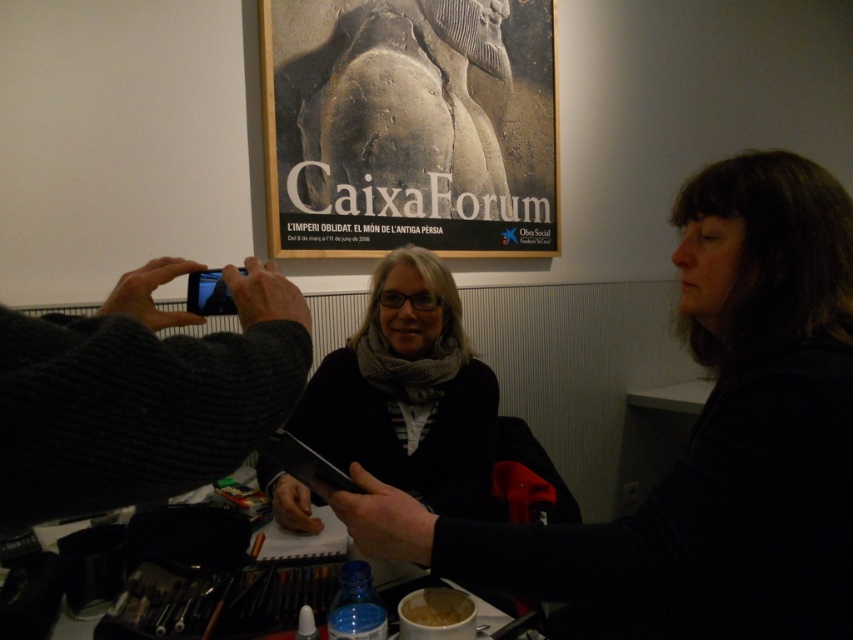
Question: Which of the following is the farthest from the observer?

Choices:
 (A) knitted dark gray sweater at left
 (B) wooden table at center

Answer: (B)

Question: Estimate the real-world distances between objects in this image. Which object is farther from the white matte coffee cup at center?

Choices:
 (A) knitted dark gray sweater at left
 (B) wooden table at center
 (C) matte black scarf at center
 (D) dark gray sweater at center

Answer: (C)

Question: From the image, what is the correct spatial relationship of knitted dark gray sweater at left in relation to white matte coffee cup at center?

Choices:
 (A) above
 (B) below

Answer: (A)

Question: Which point is closer to the camera?

Choices:
 (A) matte black scarf at center
 (B) knitted dark gray sweater at left
 (C) wooden table at center
 (D) dark gray sweater at center

Answer: (B)

Question: Where is knitted dark gray sweater at left located in relation to wooden table at center in the image?

Choices:
 (A) left
 (B) right

Answer: (B)

Question: Is dark gray sweater at center below knitted dark gray sweater at left?

Choices:
 (A) yes
 (B) no

Answer: (A)